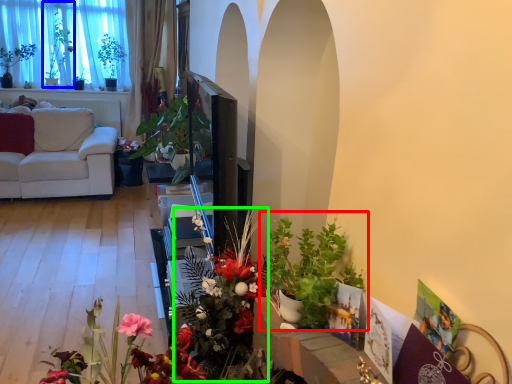
Question: Which object is the farthest from houseplant (highlighted by a red box)? Choose among these: bouquet (highlighted by a blue box) or floral arrangement (highlighted by a green box).

Choices:
 (A) bouquet
 (B) floral arrangement

Answer: (A)